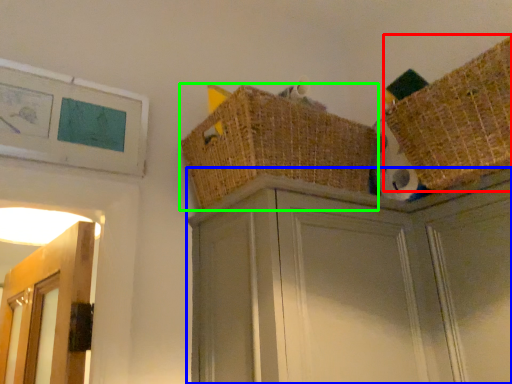
Question: Which object is positioned farthest from basket (highlighted by a red box)? Select from cabinetry (highlighted by a blue box) and basket (highlighted by a green box).

Choices:
 (A) cabinetry
 (B) basket

Answer: (B)